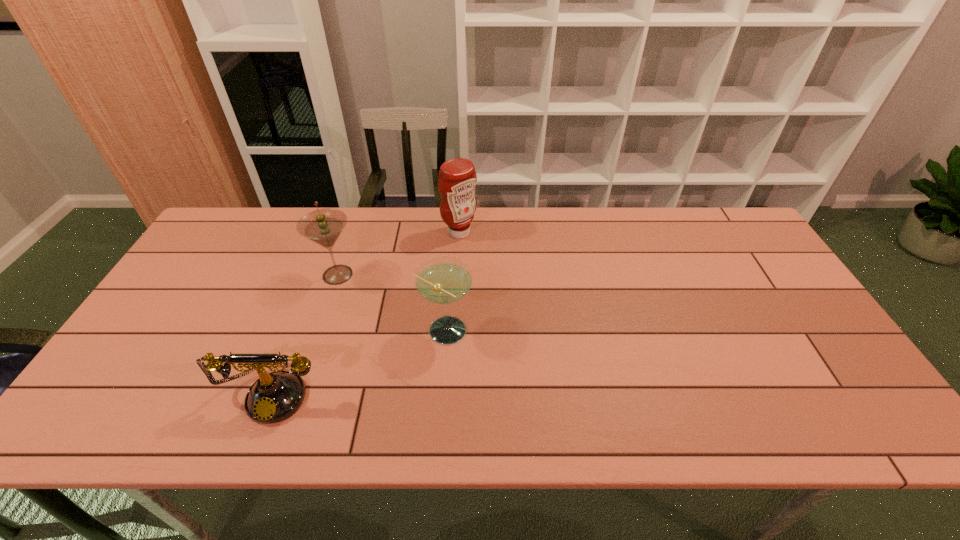
Identify the location of free point between the farther martini and the condiment. (398, 254).

Where is `unoccupied position between the nearest object and the farthest object`? This screenshot has height=540, width=960. unoccupied position between the nearest object and the farthest object is located at coordinates (x=368, y=312).

Locate an element on the screen. The width and height of the screenshot is (960, 540). vacant area that lies between the farther martini and the right martini is located at coordinates (391, 303).

Where is `free area in between the third nearest object and the farthest object`? The height and width of the screenshot is (540, 960). free area in between the third nearest object and the farthest object is located at coordinates (398, 254).

Find the location of a particular element. The image size is (960, 540). vacant point located between the nearest object and the right martini is located at coordinates (360, 361).

The width and height of the screenshot is (960, 540). In order to click on free space between the farthest object and the telephone in this screenshot , I will do `click(368, 312)`.

Find the location of `free space between the farther martini and the shortest object`. free space between the farther martini and the shortest object is located at coordinates (307, 333).

This screenshot has width=960, height=540. In order to click on object that is the third nearest to the nearer martini in this screenshot , I will do `click(457, 179)`.

This screenshot has width=960, height=540. Identify the location of object that is the third closest to the farthest object. (274, 397).